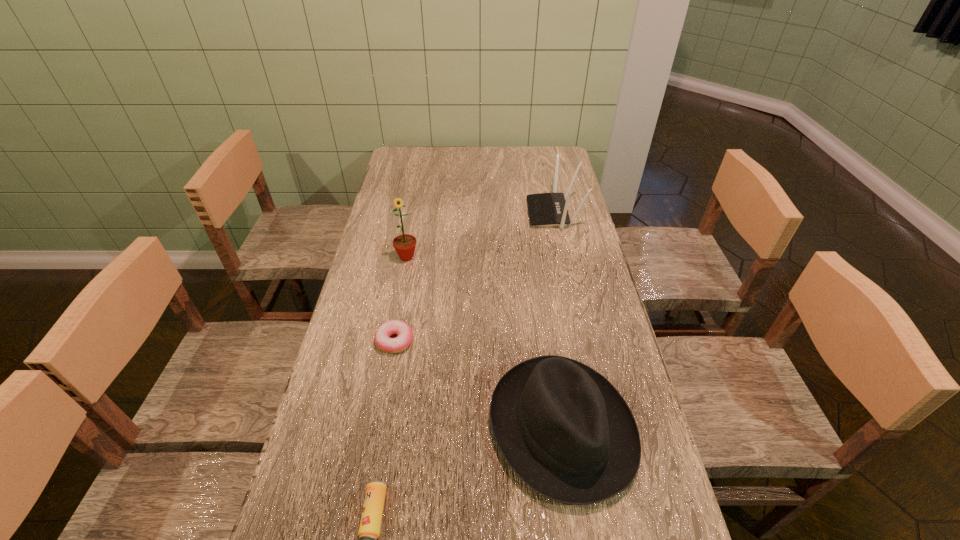
Image resolution: width=960 pixels, height=540 pixels. Identify the location of the fourth nearest object. (404, 244).

Image resolution: width=960 pixels, height=540 pixels. Identify the location of sunflower. (404, 244).

You are a GUI agent. You are given a task and a screenshot of the screen. Output one action in this format:
    pyautogui.click(x=<x>, y=<y>)
    Task: Click on the farthest object
    
    Given the screenshot: What is the action you would take?
    click(x=545, y=209)

I want to click on the third shortest object, so click(x=564, y=429).

Where is `doughnut`? The image size is (960, 540). doughnut is located at coordinates (382, 335).

Where is `free space located 0.380m on the face of the tallest object`? This screenshot has width=960, height=540. free space located 0.380m on the face of the tallest object is located at coordinates (387, 363).

Locate an element on the screen. The width and height of the screenshot is (960, 540). free spot located on the front-facing side of the router is located at coordinates (487, 213).

At what (x,y) coordinates should I click in order to perform the action: click on blank area located 0.120m on the front-facing side of the router. Please return your answer as a coordinate pair (x, y). The width and height of the screenshot is (960, 540). Looking at the image, I should click on (495, 213).

I want to click on free space located 0.220m on the front-facing side of the router, so click(x=468, y=213).

Where is `vacant space located on the back of the third shortest object`? Image resolution: width=960 pixels, height=540 pixels. vacant space located on the back of the third shortest object is located at coordinates (549, 339).